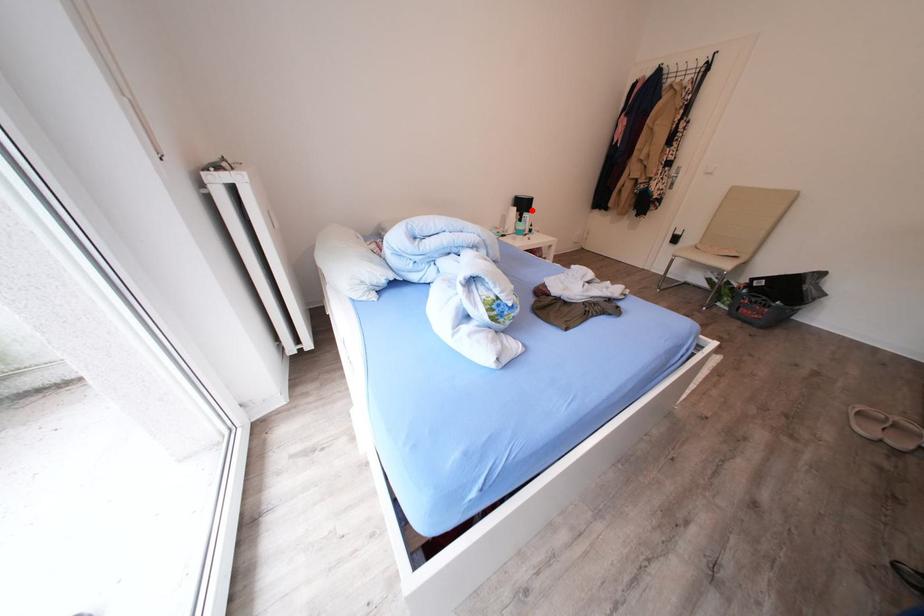
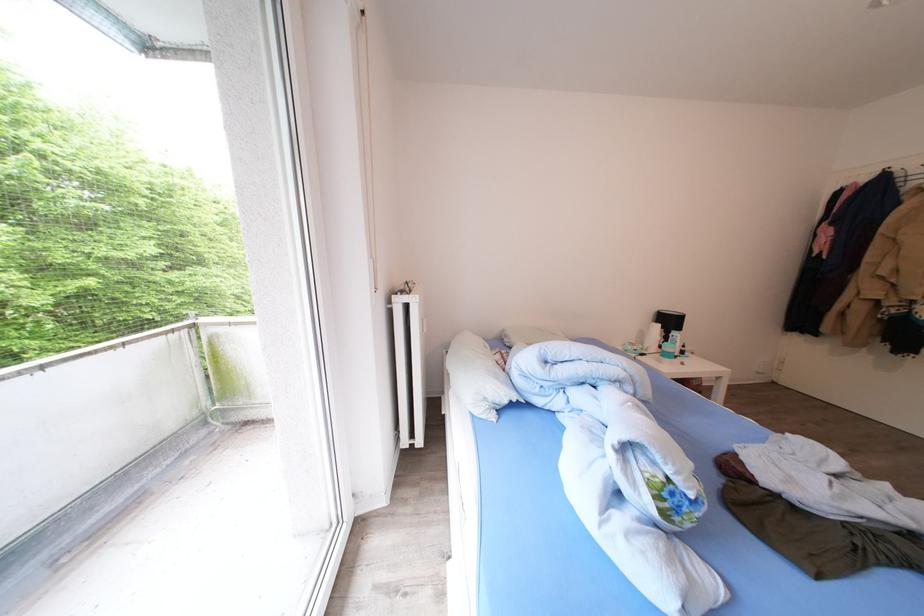
Find the pixel in the second image that matches the highlighted location in the first image.

(677, 326)